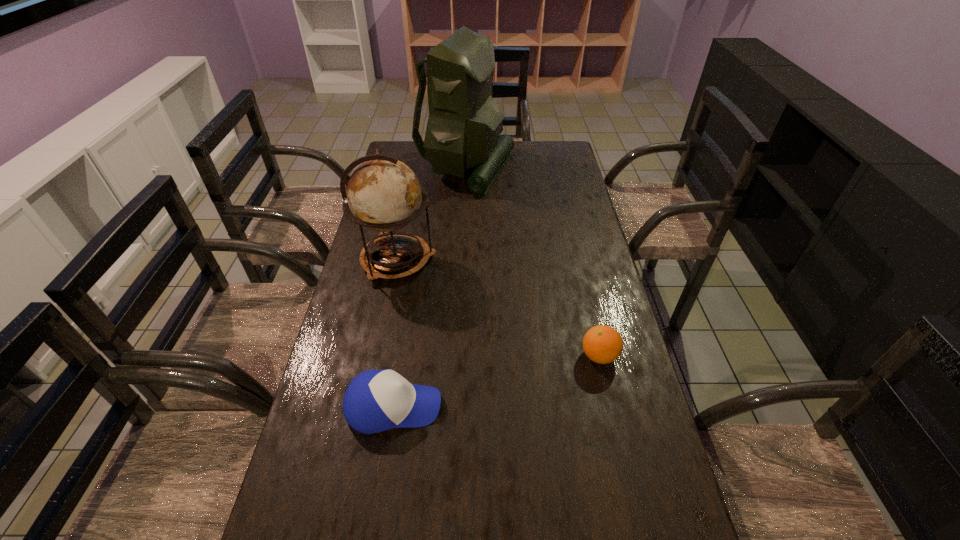
In the image, there is a desktop. At what (x,y) coordinates should I click in order to perform the action: click on vacant space at the far left corner. Please return your answer as a coordinate pair (x, y). Looking at the image, I should click on (395, 151).

The width and height of the screenshot is (960, 540). Identify the location of free space at the far right corner. (565, 147).

The image size is (960, 540). Find the location of `free area in between the tallest object and the third shortest object`. free area in between the tallest object and the third shortest object is located at coordinates (431, 214).

Identify the location of free spot between the tallest object and the orange. (532, 261).

The height and width of the screenshot is (540, 960). What are the coordinates of `object that ranks as the second closest to the orange` in the screenshot? It's located at (384, 194).

Image resolution: width=960 pixels, height=540 pixels. I want to click on object identified as the third closest to the rightmost object, so click(464, 123).

Image resolution: width=960 pixels, height=540 pixels. Find the location of `free location that satisfies the following two spatial constraints: 1. on the front of the orange with visible pockets; 2. on the left side of the farthest object`. free location that satisfies the following two spatial constraints: 1. on the front of the orange with visible pockets; 2. on the left side of the farthest object is located at coordinates (457, 356).

This screenshot has width=960, height=540. Identify the location of vacant space that satisfies the following two spatial constraints: 1. on the back side of the orange; 2. at the center of the second farthest object. (577, 260).

At what (x,y) coordinates should I click in order to perform the action: click on vacant region that satisfies the following two spatial constraints: 1. at the center of the second farthest object; 2. on the right side of the orange. Please return your answer as a coordinate pair (x, y). Looking at the image, I should click on (x=378, y=356).